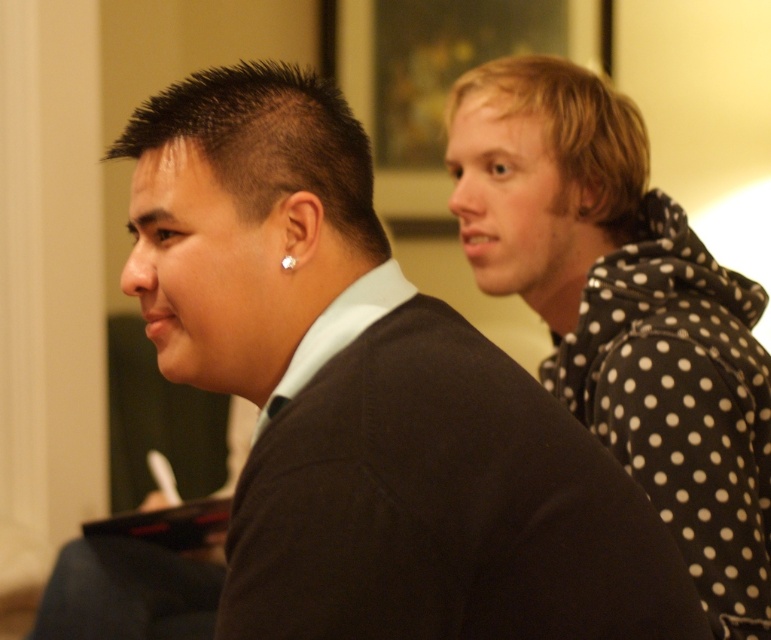
Question: Which object appears farthest from the camera in this image?

Choices:
 (A) silver metallic earring at left
 (B) dark brown knit sweater at center
 (C) black polka dot hoodie at right

Answer: (C)

Question: Which of these objects is positioned closest to the dark brown knit sweater at center?

Choices:
 (A) silver metallic earring at left
 (B) black polka dot hoodie at right

Answer: (A)

Question: In this image, where is dark brown knit sweater at center located relative to silver metallic earring at left?

Choices:
 (A) above
 (B) below

Answer: (B)

Question: Which object is the farthest from the dark brown knit sweater at center?

Choices:
 (A) silver metallic earring at left
 (B) black polka dot hoodie at right

Answer: (B)

Question: Is the position of dark brown knit sweater at center less distant than that of black polka dot hoodie at right?

Choices:
 (A) yes
 (B) no

Answer: (A)

Question: Can you confirm if dark brown knit sweater at center is wider than silver metallic earring at left?

Choices:
 (A) no
 (B) yes

Answer: (B)